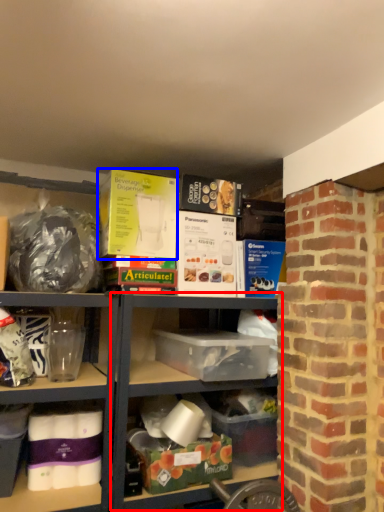
Question: Which object appears farthest to the camera in this image, shelf (highlighted by a red box) or box (highlighted by a blue box)?

Choices:
 (A) shelf
 (B) box

Answer: (B)